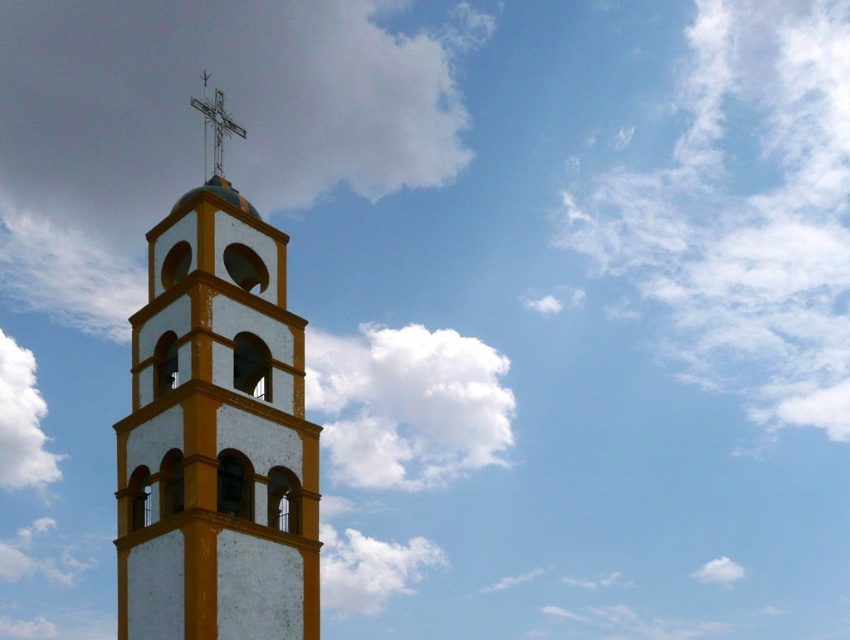
Does white fluffy cloud at center come in front of white fluffy cloud at upper center?

That is False.

How distant is white fluffy cloud at center from white fluffy cloud at upper center?

A distance of 37.26 feet exists between white fluffy cloud at center and white fluffy cloud at upper center.

This screenshot has height=640, width=850. Find the location of `white fluffy cloud at center`. white fluffy cloud at center is located at coordinates (408, 404).

Identify the location of white fluffy cloud at center. This screenshot has height=640, width=850. (408, 404).

What do you see at coordinates (216, 432) in the screenshot? I see `white painted stone bell tower at left` at bounding box center [216, 432].

Is point (216, 115) positioned behind point (212, 161)?

No.

This screenshot has width=850, height=640. I want to click on white painted stone bell tower at left, so click(216, 432).

At what (x,y) coordinates should I click in order to perform the action: click on white painted stone bell tower at left. Please return your answer as a coordinate pair (x, y). The image size is (850, 640). Looking at the image, I should click on (216, 432).

Which is in front, point (383, 568) or point (9, 426)?

Positioned in front is point (383, 568).

Is white fluffy cloud at upper center smaller than white fluffy cloud at upper left?

Incorrect, white fluffy cloud at upper center is not smaller in size than white fluffy cloud at upper left.

Between point (344, 552) and point (20, 356), which one is positioned in front?

Point (344, 552) is in front.

Identify the location of white fluffy cloud at upper center. This screenshot has height=640, width=850. (369, 568).